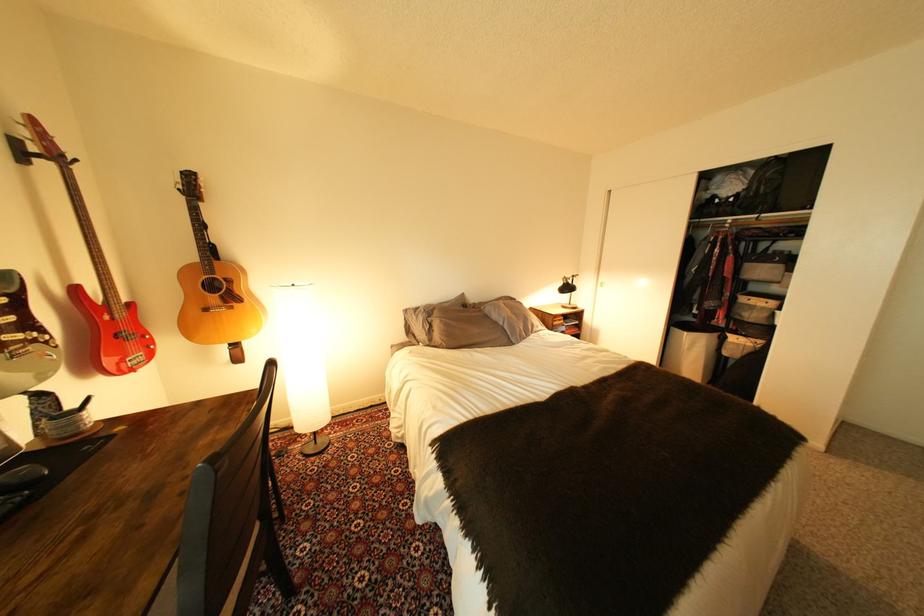
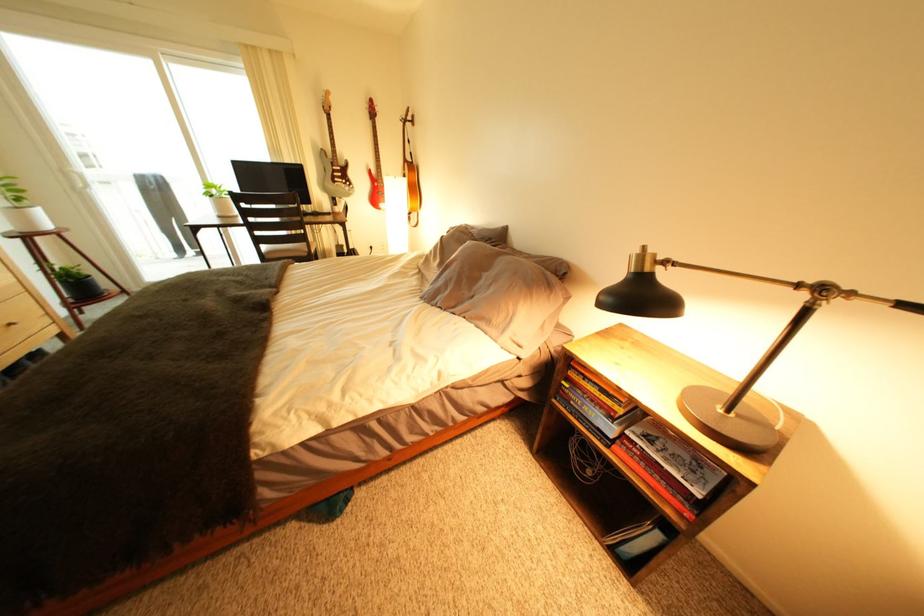
In the second image, find the point that corresponds to (x=586, y=278) in the first image.

(834, 291)